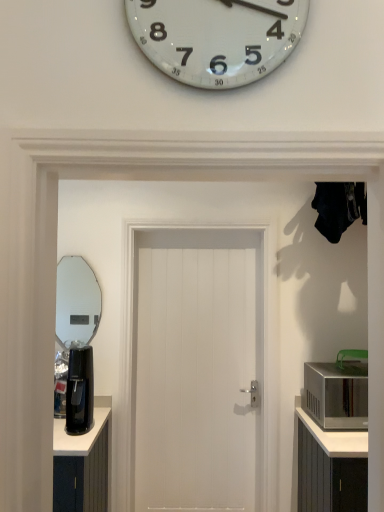
Question: Relative to silver metallic microwave at right, is clear glass mirror at left in front or behind?

Choices:
 (A) behind
 (B) front

Answer: (A)

Question: From a real-world perspective, is clear glass mirror at left positioned above or below silver metallic microwave at right?

Choices:
 (A) above
 (B) below

Answer: (A)

Question: Which of these objects is positioned closest to the white wooden door at center?

Choices:
 (A) silver metallic microwave at right
 (B) clear glass mirror at left
 (C) black plastic coffee machine at left

Answer: (C)

Question: Which object is the farthest from the black plastic coffee machine at left?

Choices:
 (A) white wooden door at center
 (B) silver metallic microwave at right
 (C) clear glass mirror at left

Answer: (C)